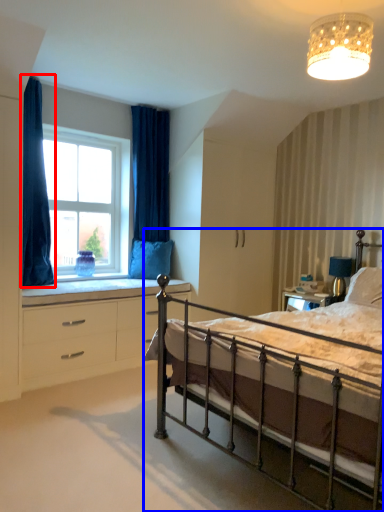
Question: Which of the following is the closest to the observer, curtain (highlighted by a red box) or bed (highlighted by a blue box)?

Choices:
 (A) curtain
 (B) bed

Answer: (B)